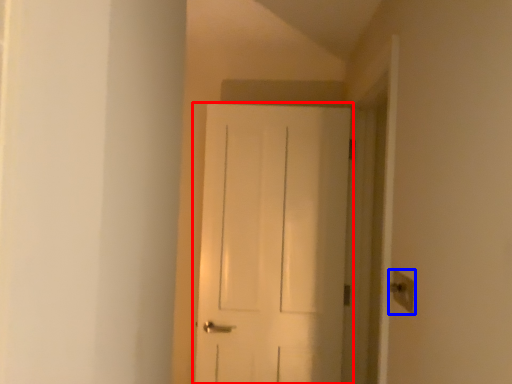
Question: Among these objects, which one is farthest to the camera, door (highlighted by a red box) or light switch (highlighted by a blue box)?

Choices:
 (A) door
 (B) light switch

Answer: (A)